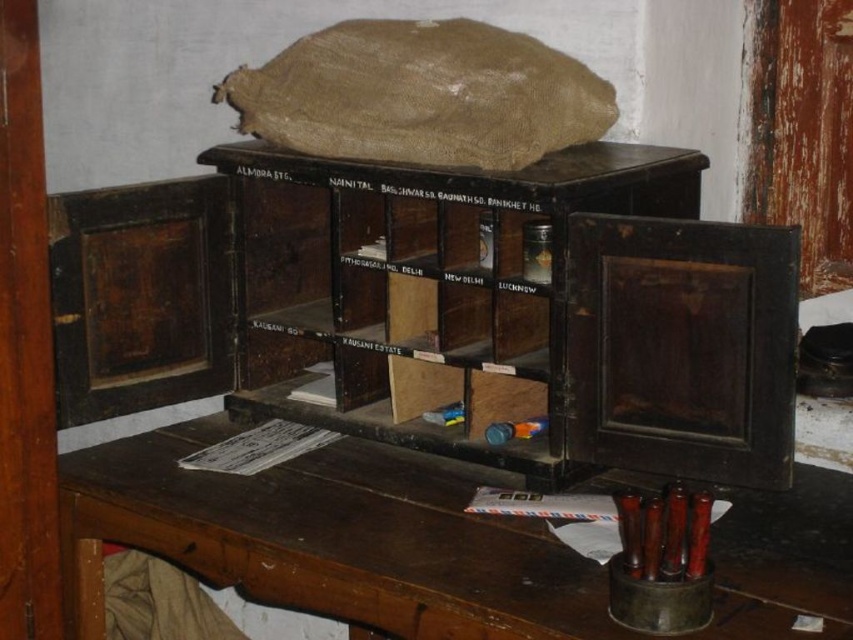
Question: Does wooden table at center appear over dark wood bookshelf at center?

Choices:
 (A) no
 (B) yes

Answer: (A)

Question: Is wooden table at center further to camera compared to dark wood bookshelf at center?

Choices:
 (A) no
 (B) yes

Answer: (A)

Question: Which object is farther from the camera taking this photo?

Choices:
 (A) dark wood bookshelf at center
 (B) wooden table at center

Answer: (A)

Question: Considering the relative positions of wooden table at center and dark wood bookshelf at center in the image provided, where is wooden table at center located with respect to dark wood bookshelf at center?

Choices:
 (A) right
 (B) left

Answer: (B)